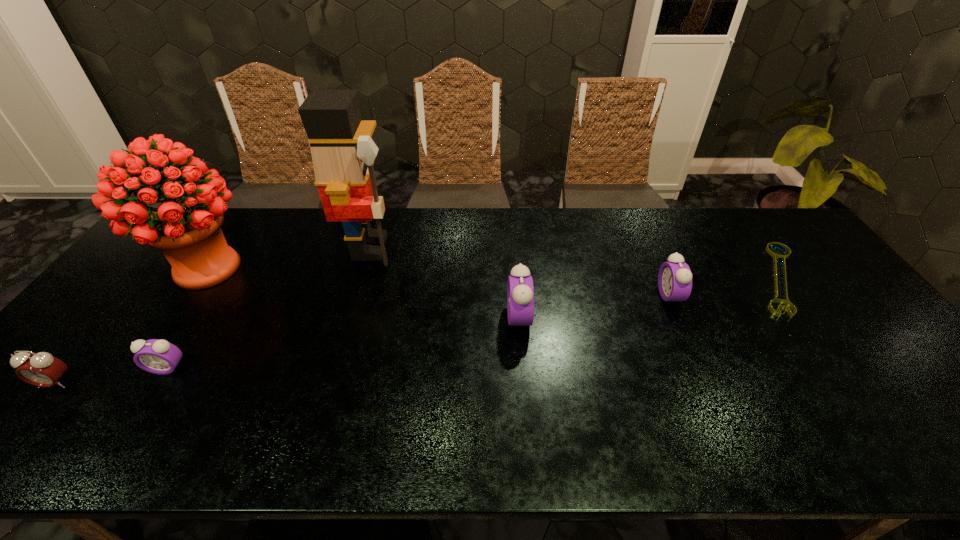
If equal spacing is the goal by inserting an additional alarm_clock among them, please point out a vacant space for this new alarm_clock. Please provide its 2D coordinates. Your answer should be formatted as a tuple, i.e. [(x, y)], where the tuple contains the x and y coordinates of a point satisfying the conditions above.

[(352, 341)]